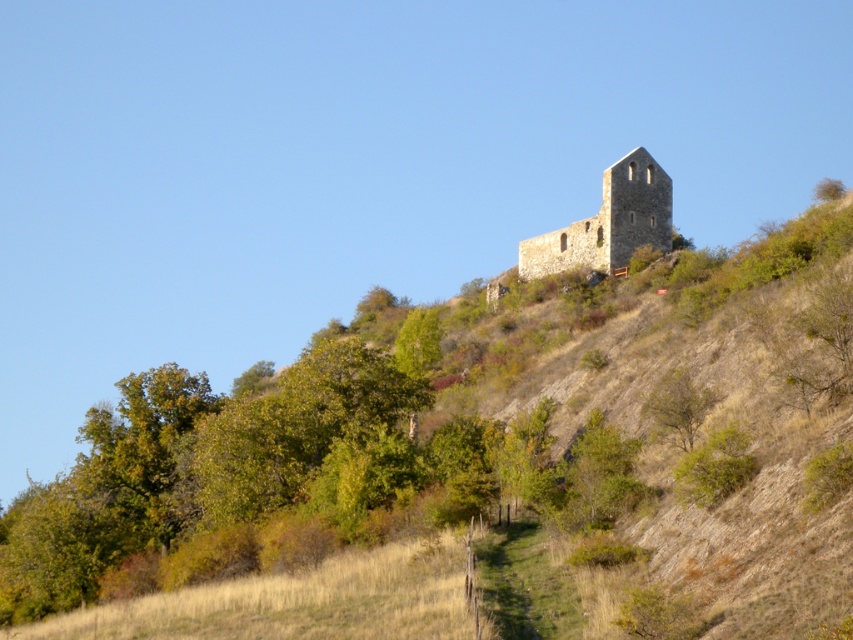
You are a hiker planning to climb the hill and reach the stone tower at upper right. You notice the brown stone ruins at upper center along the way. Which structure will require more effort to climb around, considering their size?

The brown stone ruins at upper center requires more effort to climb around because it has a larger size compared to the stone tower at upper right.

You are standing at the bottom of the hill and looking up. There is a point marked at coordinates (479,458) on the hillside. What is located at that point?

The point at (479,458) marks the location of the brown stone ruins at upper center.